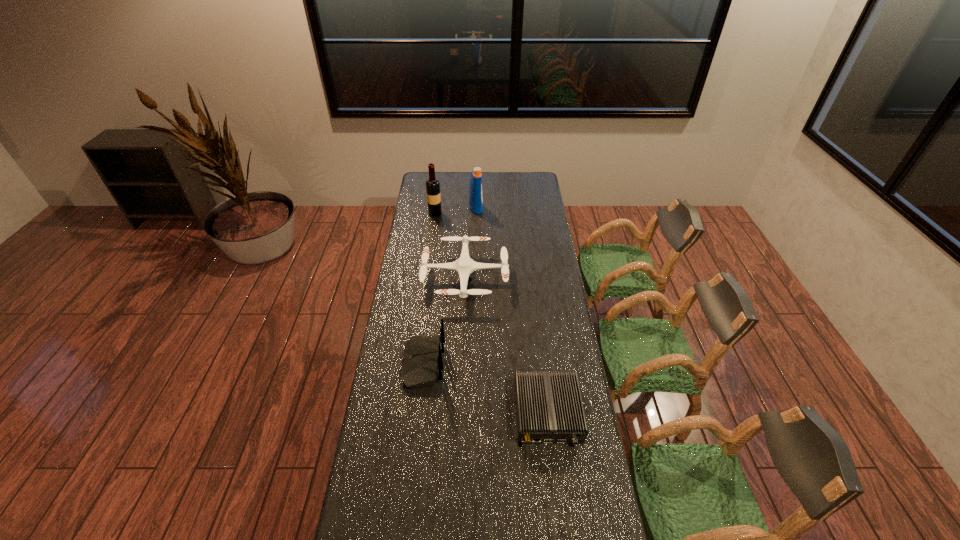
Find the location of a particular element. vacant area located on the back of the taller router is located at coordinates (538, 364).

Where is `free space located with the camera attached at the bottom of the drone`? free space located with the camera attached at the bottom of the drone is located at coordinates (538, 278).

The image size is (960, 540). Find the location of `vacant space located on the back panel of the shortest object`. vacant space located on the back panel of the shortest object is located at coordinates (556, 485).

Where is `wine bottle that is at the left edge`? wine bottle that is at the left edge is located at coordinates (432, 184).

This screenshot has width=960, height=540. In order to click on router that is at the left edge in this screenshot , I will do click(x=422, y=365).

You are a GUI agent. You are given a task and a screenshot of the screen. Output one action in this format:
    pyautogui.click(x=<x>, y=<y>)
    Task: Click on the drone located in the left edge section of the desktop
    Image resolution: width=960 pixels, height=540 pixels.
    Given the screenshot: What is the action you would take?
    pyautogui.click(x=464, y=266)

You are a GUI agent. You are given a task and a screenshot of the screen. Output one action in this format:
    pyautogui.click(x=<x>, y=<y>)
    Task: Click on the object that is at the right edge
    
    Given the screenshot: What is the action you would take?
    pyautogui.click(x=549, y=409)

Where is `vacant space at the left edge`? This screenshot has height=540, width=960. vacant space at the left edge is located at coordinates (411, 248).

What are the coordinates of `vacant space at the right edge of the desktop` in the screenshot? It's located at (533, 208).

Find the location of a particular element. vacant space at the far left corner is located at coordinates (420, 188).